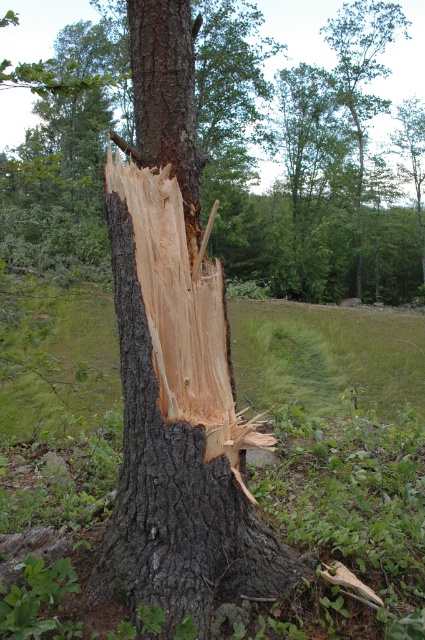
Is smooth brown bark at center further to the viewer compared to dark brown rough bark at center?

Yes, smooth brown bark at center is further from the viewer.

Does smooth brown bark at center appear over dark brown rough bark at center?

Yes.

The height and width of the screenshot is (640, 425). I want to click on smooth brown bark at center, so click(306, 161).